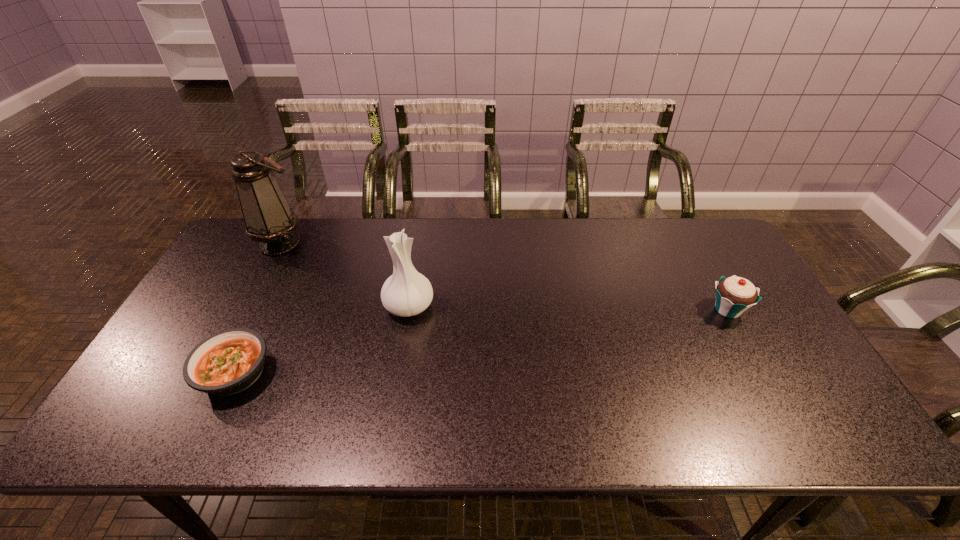
This screenshot has width=960, height=540. What are the coordinates of `unoccupied area between the rightmost object and the second tallest object` in the screenshot? It's located at (568, 308).

Image resolution: width=960 pixels, height=540 pixels. Find the location of `free space between the nearest object and the rightmost object`. free space between the nearest object and the rightmost object is located at coordinates click(481, 341).

Find the location of a particular element. free space between the rightmost object and the farthest object is located at coordinates (504, 276).

Image resolution: width=960 pixels, height=540 pixels. Find the location of `the third closest object to the farthest object`. the third closest object to the farthest object is located at coordinates (734, 295).

The image size is (960, 540). In order to click on the second closest object relative to the farthest object in this screenshot , I will do click(x=228, y=362).

This screenshot has width=960, height=540. I want to click on vacant space that satisfies the following two spatial constraints: 1. on the front side of the third shortest object; 2. on the left side of the oil lamp, so click(x=247, y=306).

Where is `vacant space that satisfies the following two spatial constraints: 1. on the back side of the stew; 2. on the right side of the cupcake`? This screenshot has height=540, width=960. vacant space that satisfies the following two spatial constraints: 1. on the back side of the stew; 2. on the right side of the cupcake is located at coordinates (265, 309).